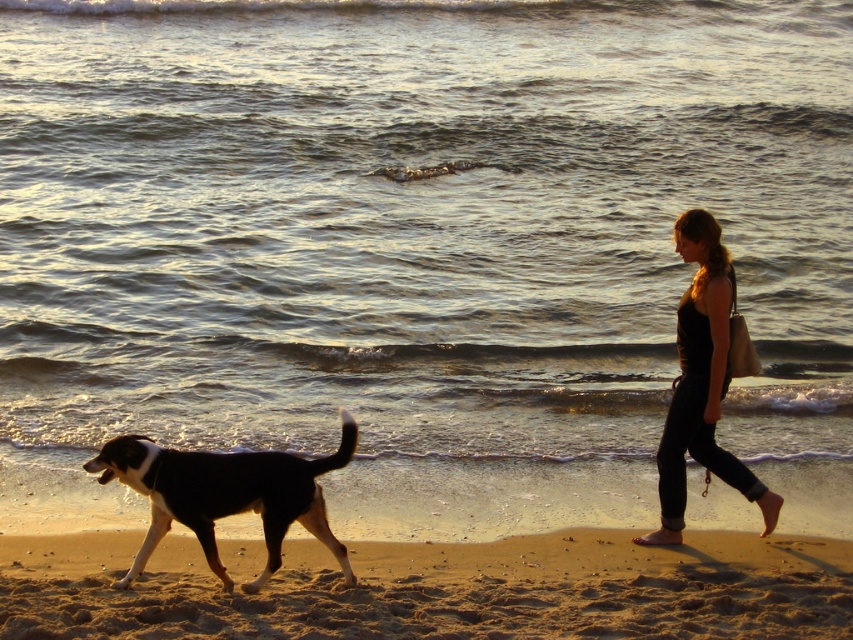
Who is more distant from viewer, [364,636] or [669,458]?

Positioned behind is point [669,458].

Which of these two, sandy yellow sand at lower center or black cotton tank top at right, stands shorter?

sandy yellow sand at lower center is shorter.

Locate an element on the screen. The image size is (853, 640). sandy yellow sand at lower center is located at coordinates (438, 588).

Does point (604, 600) lie behind point (207, 493)?

That is True.

Is point (142, 579) less distant than point (256, 461)?

No, (142, 579) is behind (256, 461).

Identify the location of sandy yellow sand at lower center. pyautogui.click(x=438, y=588).

Between black and white fur dog at lower left and black cotton tank top at right, which one is positioned lower?

black and white fur dog at lower left

Based on the photo, can you confirm if black and white fur dog at lower left is positioned above black cotton tank top at right?

Incorrect, black and white fur dog at lower left is not positioned above black cotton tank top at right.

Image resolution: width=853 pixels, height=640 pixels. Describe the element at coordinates (225, 493) in the screenshot. I see `black and white fur dog at lower left` at that location.

At what (x,y) coordinates should I click in order to perform the action: click on black and white fur dog at lower left. Please return your answer as a coordinate pair (x, y). Image resolution: width=853 pixels, height=640 pixels. Looking at the image, I should click on (225, 493).